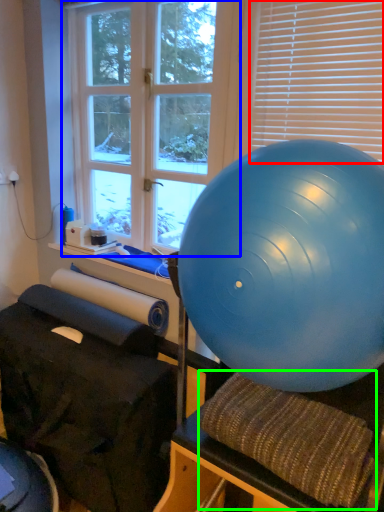
Question: Which object is positioned closest to blind (highlighted by a red box)? Select from window (highlighted by a blue box) and bean bag chair (highlighted by a green box).

Choices:
 (A) window
 (B) bean bag chair

Answer: (A)